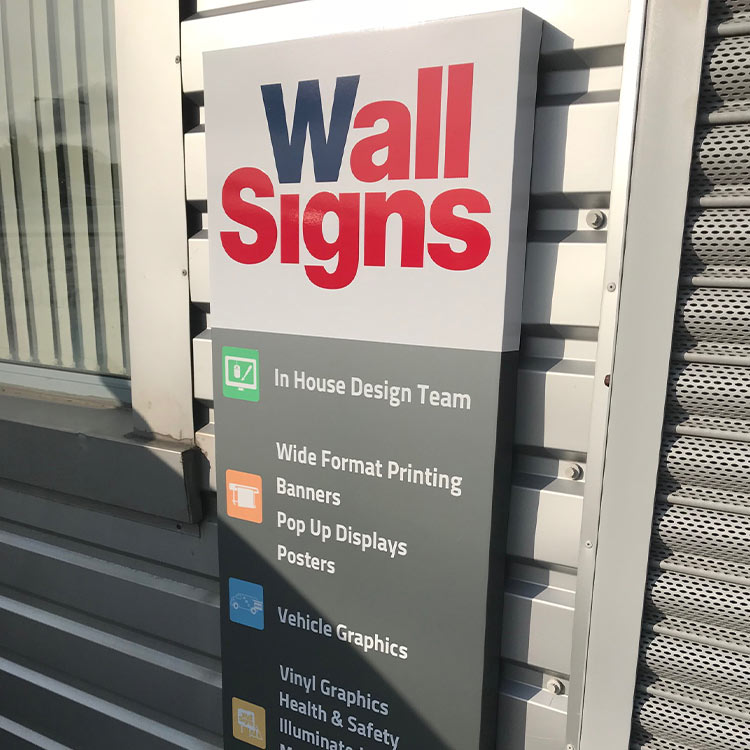
Locate an element on the screen. The image size is (750, 750). window is located at coordinates (16, 278).